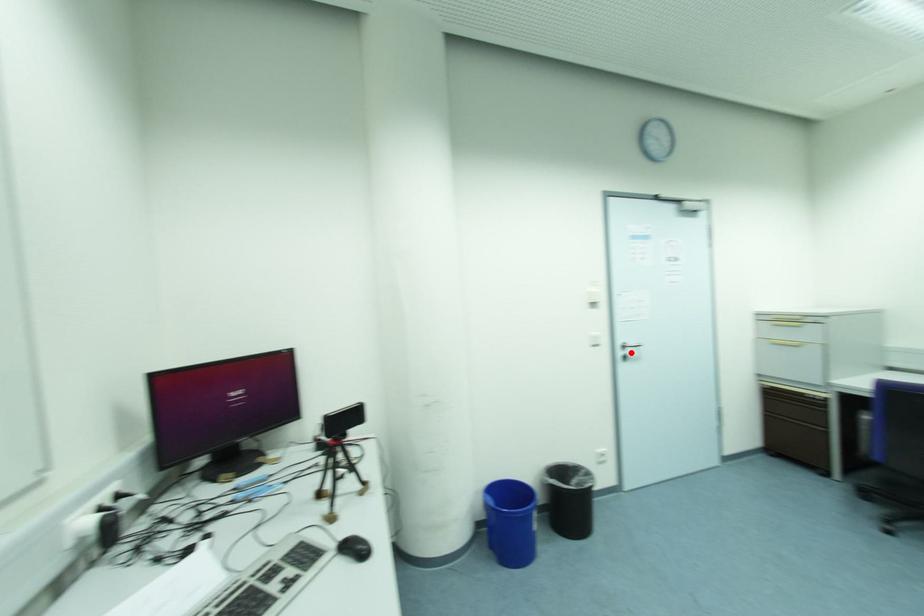
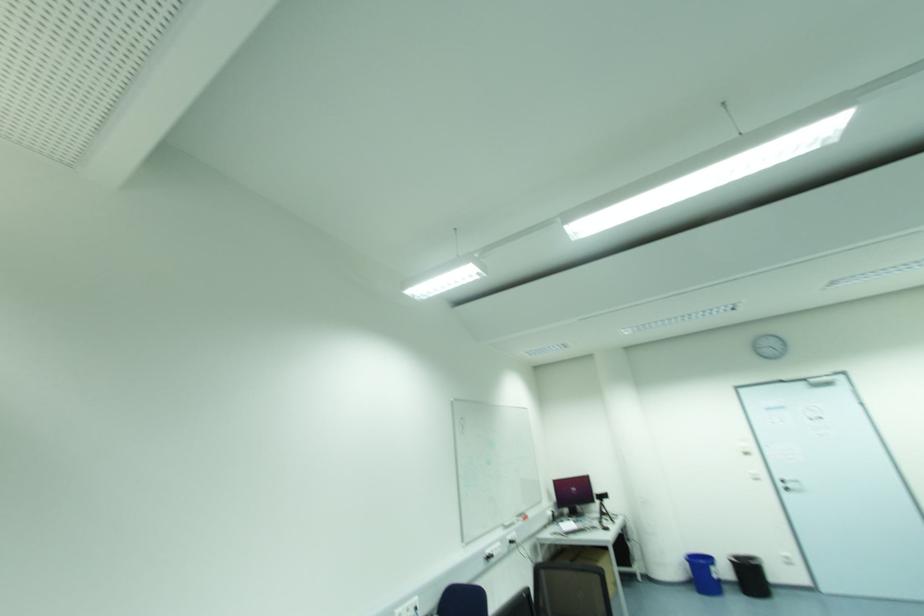
Find the pixel in the second image that matches the highlighted location in the first image.

(789, 485)